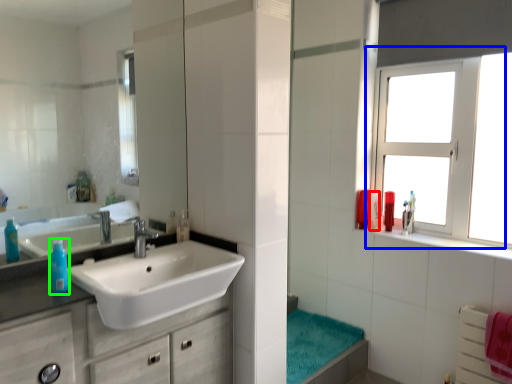
Question: Which object is positioned closest to mouthwash (highlighted by a red box)? Select from window (highlighted by a blue box) and turquoise (highlighted by a green box).

Choices:
 (A) window
 (B) turquoise

Answer: (A)